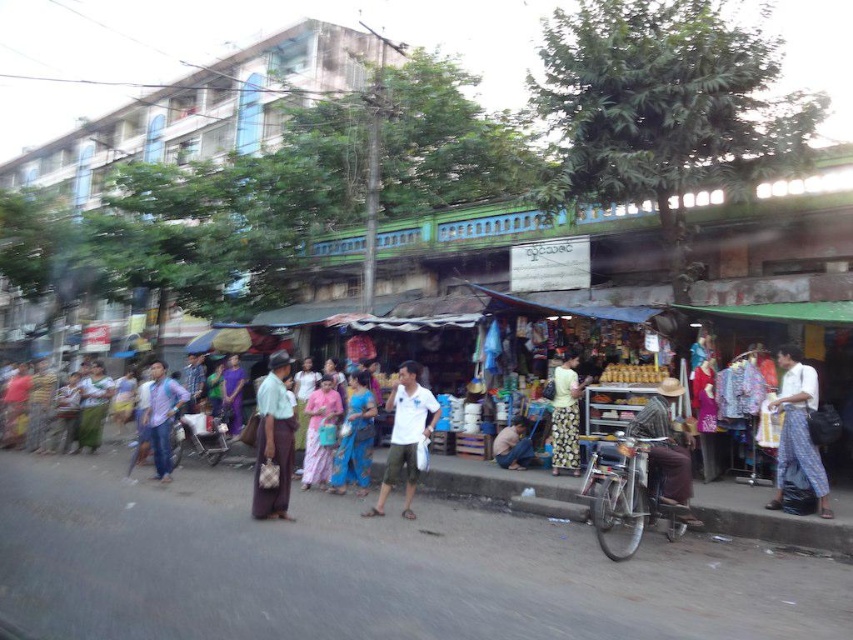
Is brown woven hat at center in front of pink fabric dress at center?

Yes, brown woven hat at center is closer to the viewer.

What are the coordinates of `brown woven hat at center` in the screenshot? It's located at (666, 449).

Is point (386, 486) positioned before point (338, 397)?

Yes, it is in front of point (338, 397).

Does white matte shirt at center have a greater height compared to pink fabric dress at center?

Yes.

Is point (439, 410) behind point (334, 406)?

Yes, it is.

At what (x,y) coordinates should I click in order to perform the action: click on white matte shirt at center. Please return your answer as a coordinate pair (x, y). Looking at the image, I should click on 405,435.

Does brown woven hat at center have a greater width compared to floral fabric skirt at center?

Yes.

Can you confirm if brown woven hat at center is positioned below floral fabric skirt at center?

Correct, brown woven hat at center is located below floral fabric skirt at center.

Image resolution: width=853 pixels, height=640 pixels. What do you see at coordinates (666, 449) in the screenshot?
I see `brown woven hat at center` at bounding box center [666, 449].

This screenshot has height=640, width=853. Identify the location of brown woven hat at center. (666, 449).